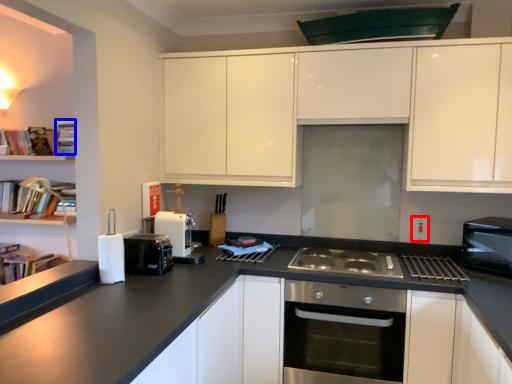
Question: Which object is further to the camera taking this photo, electric outlet (highlighted by a red box) or book (highlighted by a blue box)?

Choices:
 (A) electric outlet
 (B) book

Answer: (B)